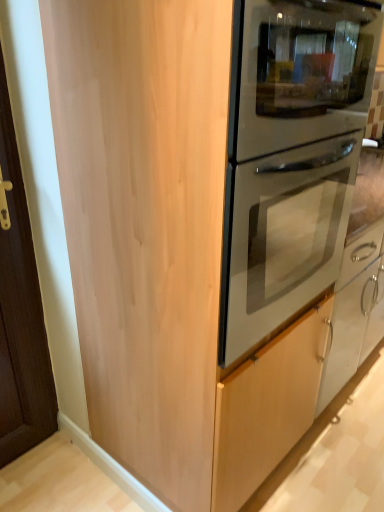
Question: From a real-world perspective, relative to silver metallic door handle at lower right, is matte silver oven at center vertically above or below?

Choices:
 (A) above
 (B) below

Answer: (A)

Question: Choose the correct answer: Is matte silver oven at center inside silver metallic door handle at lower right or outside it?

Choices:
 (A) inside
 (B) outside

Answer: (B)

Question: Is point (251, 88) positioned closer to the camera than point (369, 278)?

Choices:
 (A) closer
 (B) farther

Answer: (A)

Question: From a real-world perspective, is silver metallic door handle at lower right above or below matte silver oven at center?

Choices:
 (A) above
 (B) below

Answer: (B)

Question: Based on their sizes in the image, would you say silver metallic door handle at lower right is bigger or smaller than matte silver oven at center?

Choices:
 (A) big
 (B) small

Answer: (B)

Question: Is point (362, 288) positioned closer to the camera than point (243, 0)?

Choices:
 (A) closer
 (B) farther

Answer: (B)

Question: Visually, is silver metallic door handle at lower right positioned to the left or to the right of matte silver oven at center?

Choices:
 (A) right
 (B) left

Answer: (A)